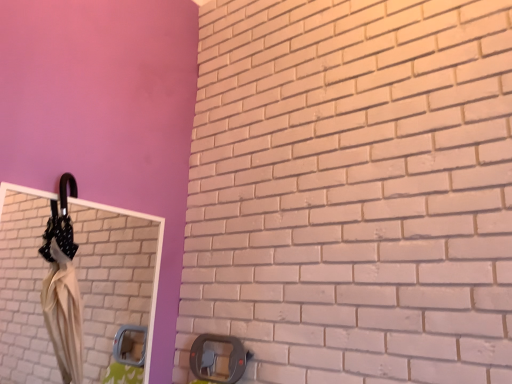
Question: Should I look upward or downward to see white glossy mirror at upper left?

Choices:
 (A) up
 (B) down

Answer: (B)